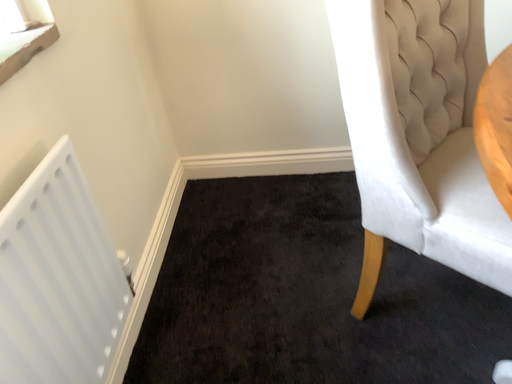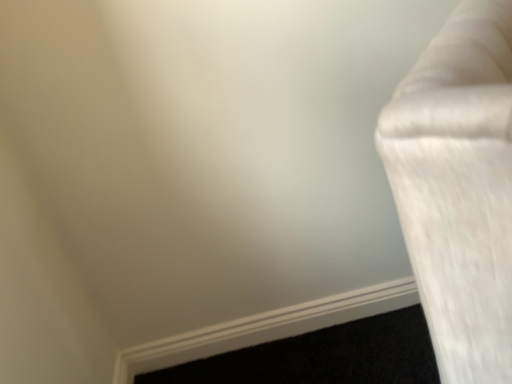
Question: Which way did the camera rotate in the video?

Choices:
 (A) rotated right
 (B) rotated left

Answer: (A)